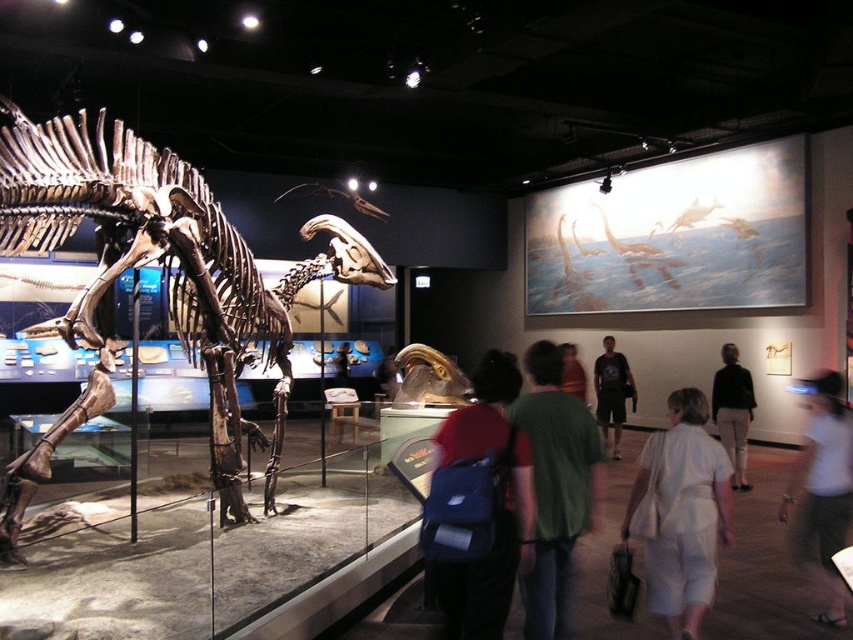
Can you confirm if blue fabric backpack at center is positioned above green fabric shirt at center?

Yes, blue fabric backpack at center is above green fabric shirt at center.

This screenshot has height=640, width=853. Find the location of `blue fabric backpack at center`. blue fabric backpack at center is located at coordinates (492, 499).

Identify the location of blue fabric backpack at center. (492, 499).

Looking at this image, who is lower down, light beige pants at center or light brown leather jacket at center?

light beige pants at center

Can you confirm if light beige pants at center is bigger than light brown leather jacket at center?

Actually, light beige pants at center might be smaller than light brown leather jacket at center.

Does point (718, 381) come closer to viewer compared to point (561, 380)?

No, it is not.

Identify the location of light beige pants at center. The width and height of the screenshot is (853, 640). (733, 412).

Between brown metallic dinosaur skeleton at center and blue fabric backpack at center, which one is positioned higher?

Positioned higher is brown metallic dinosaur skeleton at center.

Is brown metallic dinosaur skeleton at center shorter than blue fabric backpack at center?

In fact, brown metallic dinosaur skeleton at center may be taller than blue fabric backpack at center.

Is point (36, 211) farther from viewer compared to point (485, 420)?

Yes.

This screenshot has height=640, width=853. Identify the location of brown metallic dinosaur skeleton at center. (166, 284).